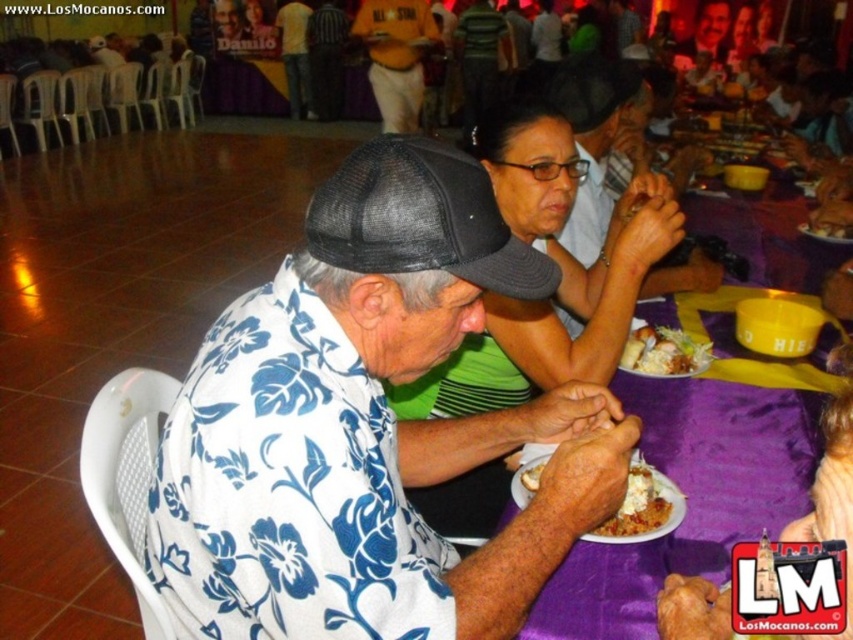
Question: Estimate the real-world distances between objects in this image. Which object is farther from the purple fabric table at center?

Choices:
 (A) matte black cap at upper center
 (B) smooth skin face at upper center
 (C) white creamy pasta at lower center
 (D) white creamy dessert at center

Answer: (B)

Question: Considering the real-world distances, which object is farthest from the white floral shirt at center?

Choices:
 (A) matte black cap at upper center
 (B) white creamy dessert at center
 (C) smooth skin face at upper center

Answer: (C)

Question: Is green fabric shirt at center thinner than white creamy pasta at lower center?

Choices:
 (A) yes
 (B) no

Answer: (B)

Question: Does matte black cap at upper center appear under striped shirt at center?

Choices:
 (A) yes
 (B) no

Answer: (A)

Question: Which point is farther from the camera taking this photo?

Choices:
 (A) (836, 332)
 (B) (302, 113)
 (C) (636, 344)
 (D) (566, 369)

Answer: (B)

Question: Does white floral shirt at center appear under green fabric shirt at center?

Choices:
 (A) no
 (B) yes

Answer: (B)